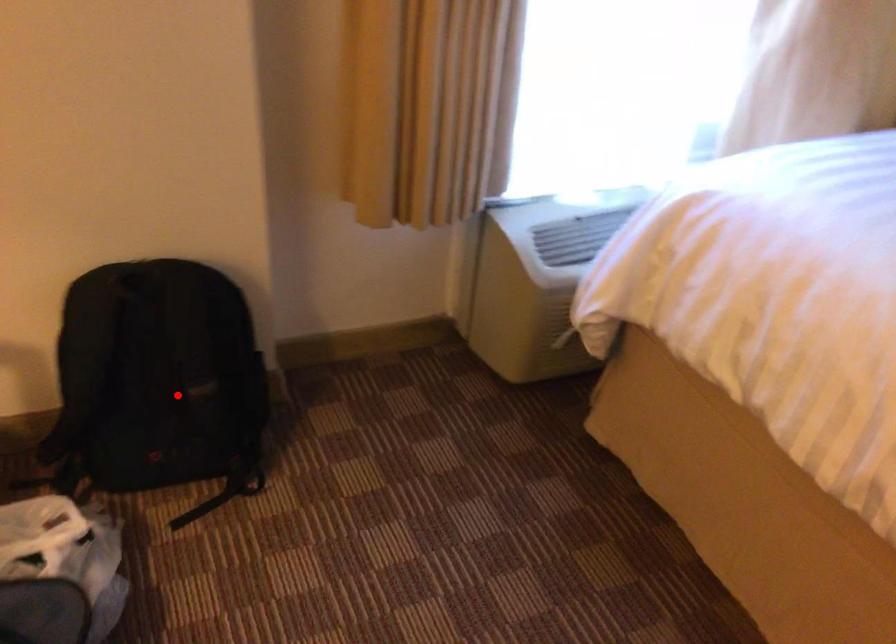
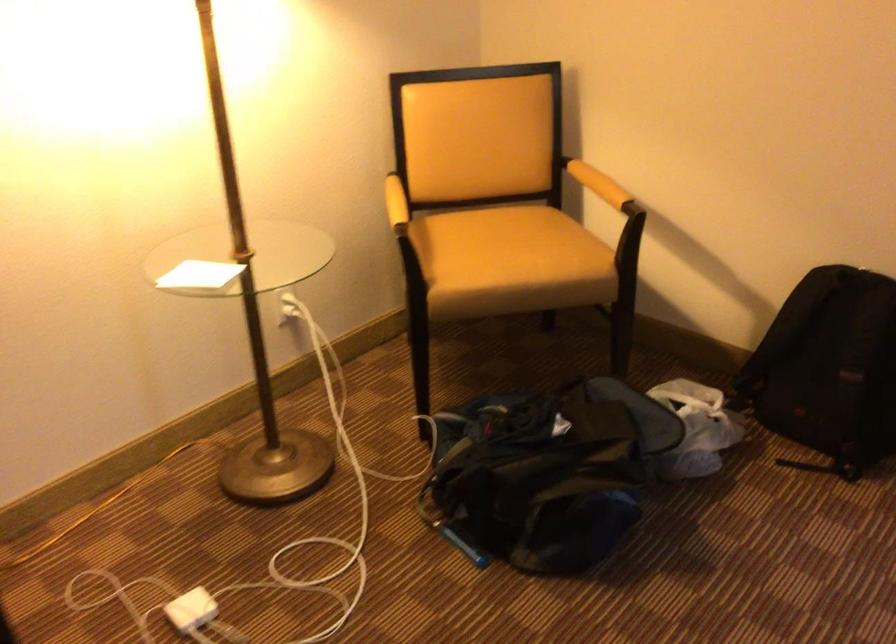
Question: I am providing you with two images of the same scene from different viewpoints. In image1, a red point is highlighted. Considering the same 3D point in image2, which of the following is correct?

Choices:
 (A) It is closer
 (B) It is farther

Answer: (B)